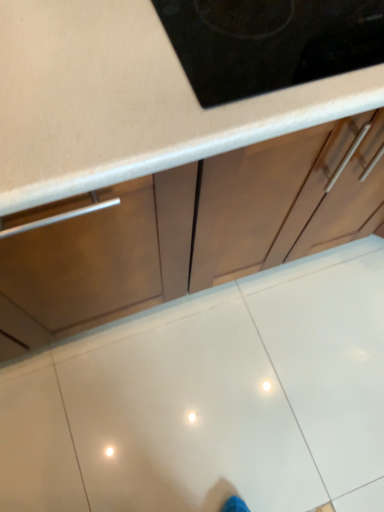
Identify the location of free space above white glossy tile at center (from a real-world perspective). The image size is (384, 512). (236, 391).